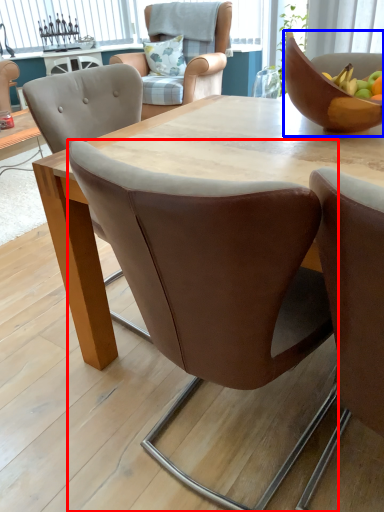
Question: Which point is further to the camera, chair (highlighted by a red box) or bowl (highlighted by a blue box)?

Choices:
 (A) chair
 (B) bowl

Answer: (B)